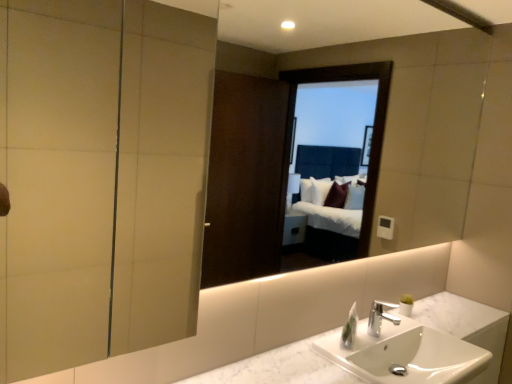
What is the approximate height of white marble counter top at center?

white marble counter top at center is 1.56 inches tall.

The image size is (512, 384). In order to click on white marble sink at lower center in this screenshot , I will do `click(426, 344)`.

The width and height of the screenshot is (512, 384). In order to click on matte glass screen door at upper left in this screenshot , I will do `click(100, 178)`.

What do you see at coordinates (380, 317) in the screenshot? This screenshot has height=384, width=512. I see `silver metallic faucet at center` at bounding box center [380, 317].

Locate an element on the screen. The width and height of the screenshot is (512, 384). silver metallic faucet at center is located at coordinates (380, 317).

The height and width of the screenshot is (384, 512). I want to click on white marble counter top at center, so click(x=279, y=367).

From a real-world perspective, is white marble sink at lower center beneath silver metallic faucet at center?

Correct, in the physical world, white marble sink at lower center is lower than silver metallic faucet at center.

Can you confirm if white marble sink at lower center is thinner than silver metallic faucet at center?

No, white marble sink at lower center is not thinner than silver metallic faucet at center.

Between white marble sink at lower center and silver metallic faucet at center, which one has less height?

With less height is silver metallic faucet at center.

Which object is closer to the camera taking this photo, white marble sink at lower center or silver metallic faucet at center?

white marble sink at lower center is in front.

Which object is more forward, white marble counter top at center or silver metallic faucet at center?

white marble counter top at center is closer to the camera.

In order to click on counter top in front of the silver metallic faucet at center in this screenshot , I will do `click(279, 367)`.

Is white marble counter top at center shorter than silver metallic faucet at center?

Yes, white marble counter top at center is shorter than silver metallic faucet at center.

From a real-world perspective, which object rests below the other?

silver metallic faucet at center.

In the scene shown: In terms of height, does matte glass screen door at upper left look taller or shorter compared to silver metallic faucet at center?

In the image, matte glass screen door at upper left appears to be taller than silver metallic faucet at center.

From the image's perspective, between matte glass screen door at upper left and silver metallic faucet at center, who is located below?

silver metallic faucet at center.

Is the surface of matte glass screen door at upper left in direct contact with silver metallic faucet at center?

No, matte glass screen door at upper left is not making contact with silver metallic faucet at center.

From the picture: From the image's perspective, is white glossy soap dispenser at lower right under white marble sink at lower center?

Actually, white glossy soap dispenser at lower right appears above white marble sink at lower center in the image.

Considering the sizes of objects white glossy soap dispenser at lower right and white marble sink at lower center in the image provided, who is taller, white glossy soap dispenser at lower right or white marble sink at lower center?

white marble sink at lower center.

Considering the positions of objects white glossy soap dispenser at lower right and white marble sink at lower center in the image provided, who is behind, white glossy soap dispenser at lower right or white marble sink at lower center?

white glossy soap dispenser at lower right is behind.

Find the location of a particular element. The image size is (512, 384). sink in front of the white glossy soap dispenser at lower right is located at coordinates (426, 344).

Which object is wider, silver metallic faucet at center or matte glass screen door at upper left?

Wider between the two is matte glass screen door at upper left.

Consider the image. How different are the orientations of silver metallic faucet at center and matte glass screen door at upper left in degrees?

The facing directions of silver metallic faucet at center and matte glass screen door at upper left are 2.16 degrees apart.

Based on the photo, considering the positions of objects silver metallic faucet at center and matte glass screen door at upper left in the image provided, who is more to the left, silver metallic faucet at center or matte glass screen door at upper left?

matte glass screen door at upper left is more to the left.

Is matte glass screen door at upper left surrounded by silver metallic faucet at center?

No, matte glass screen door at upper left is not inside silver metallic faucet at center.

Is silver metallic faucet at center at the right side of white glossy soap dispenser at lower right?

Yes, silver metallic faucet at center is to the right of white glossy soap dispenser at lower right.

Is silver metallic faucet at center closer to camera compared to white glossy soap dispenser at lower right?

No, it is not.

Does silver metallic faucet at center have a lesser height compared to white glossy soap dispenser at lower right?

In fact, silver metallic faucet at center may be taller than white glossy soap dispenser at lower right.

Is point (381, 306) behind point (356, 324)?

That is True.

Is white marble counter top at center oriented away from white glossy soap dispenser at lower right?

No, white marble counter top at center is not facing away from white glossy soap dispenser at lower right.

From a real-world perspective, does white marble counter top at center stand above white glossy soap dispenser at lower right?

No, from a real-world perspective, white marble counter top at center is not above white glossy soap dispenser at lower right.

Is white marble counter top at center smaller than white glossy soap dispenser at lower right?

No, white marble counter top at center is not smaller than white glossy soap dispenser at lower right.

Is white marble counter top at center at the left side of white glossy soap dispenser at lower right?

Incorrect, white marble counter top at center is not on the left side of white glossy soap dispenser at lower right.

I want to click on tap lying on the left of white marble sink at lower center, so click(x=380, y=317).

The image size is (512, 384). I want to click on counter top below the silver metallic faucet at center (from the image's perspective), so click(x=279, y=367).

Estimate the real-world distances between objects in this image. Which object is closer to white glossy soap dispenser at lower right, matte glass screen door at upper left or white marble counter top at center?

white marble counter top at center is positioned closer to the anchor white glossy soap dispenser at lower right.

Which object lies further to the anchor point white marble sink at lower center, white glossy soap dispenser at lower right or white marble counter top at center?

The object further to white marble sink at lower center is white glossy soap dispenser at lower right.

Consider the image. Which object lies nearer to the anchor point white marble counter top at center, white marble sink at lower center or silver metallic faucet at center?

white marble sink at lower center is positioned closer to the anchor white marble counter top at center.

When comparing their distances from white marble counter top at center, does silver metallic faucet at center or white glossy soap dispenser at lower right seem further?

white glossy soap dispenser at lower right.

When comparing their distances from silver metallic faucet at center, does white marble counter top at center or white marble sink at lower center seem further?

white marble counter top at center is further to silver metallic faucet at center.

Estimate the real-world distances between objects in this image. Which object is further from white glossy soap dispenser at lower right, white marble sink at lower center or matte glass screen door at upper left?

matte glass screen door at upper left is further to white glossy soap dispenser at lower right.

Which object lies further to the anchor point silver metallic faucet at center, white marble sink at lower center or matte glass screen door at upper left?

matte glass screen door at upper left.

Looking at the image, which one is located closer to white marble counter top at center, silver metallic faucet at center or white marble sink at lower center?

white marble sink at lower center is positioned closer to the anchor white marble counter top at center.

Locate an element on the screen. The image size is (512, 384). soap dispenser between matte glass screen door at upper left and silver metallic faucet at center in the front-back direction is located at coordinates (350, 329).

This screenshot has width=512, height=384. Identify the location of counter top between matte glass screen door at upper left and white glossy soap dispenser at lower right along the z-axis. (x=279, y=367).

In order to click on soap dispenser between white marble counter top at center and silver metallic faucet at center along the z-axis in this screenshot , I will do `click(350, 329)`.

Image resolution: width=512 pixels, height=384 pixels. I want to click on counter top between matte glass screen door at upper left and silver metallic faucet at center from front to back, so click(x=279, y=367).